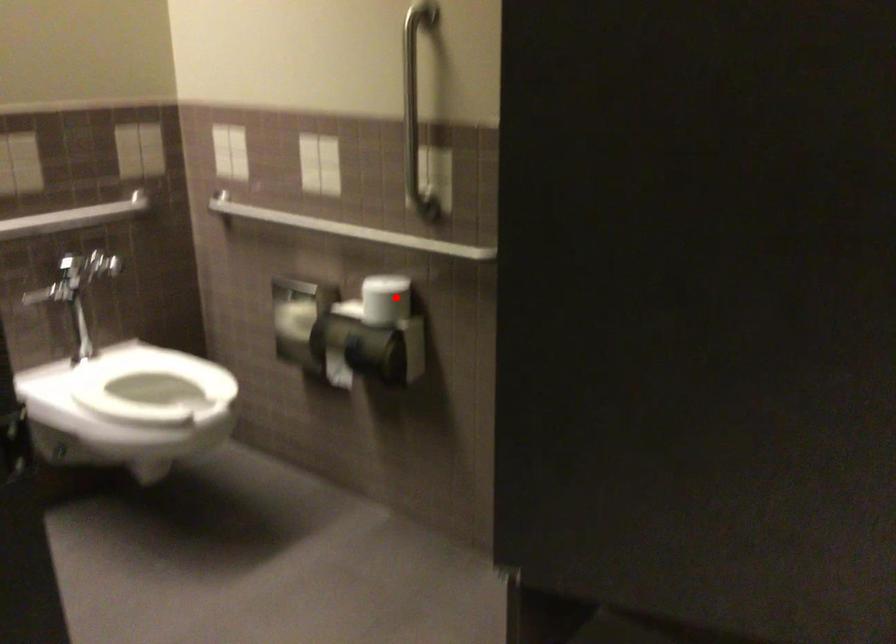
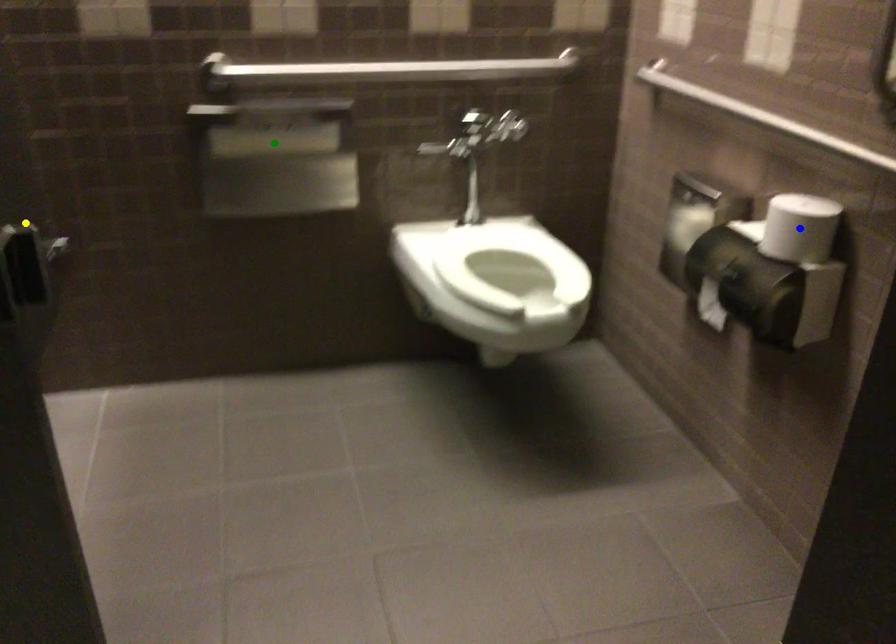
Question: I am providing you with two images of the same scene from different viewpoints. A red point is marked on the first image. You are given multiple points on the second image. Which point in image 2 is actually the same real-world point as the red point in image 1?

Choices:
 (A) blue point
 (B) green point
 (C) yellow point

Answer: (A)